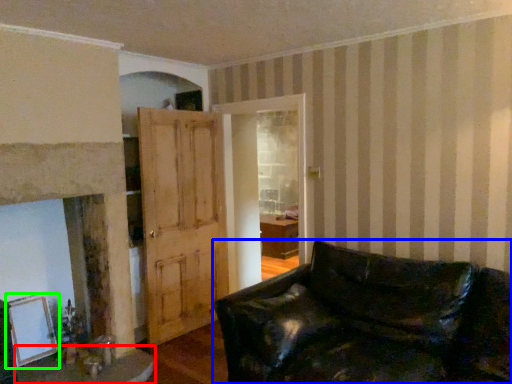
Question: Which is farther away from table (highlighted by a red box)? studio couch (highlighted by a blue box) or picture frame (highlighted by a green box)?

Choices:
 (A) studio couch
 (B) picture frame

Answer: (A)